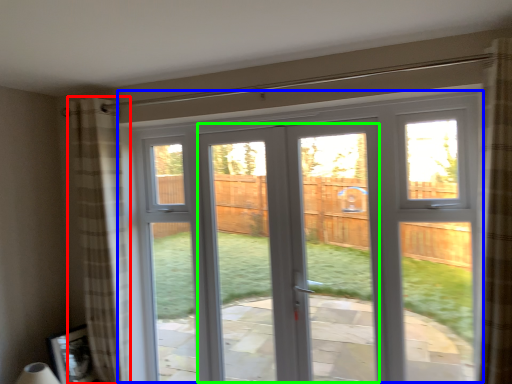
Question: Which object is positioned farthest from curtain (highlighted by a red box)? Select from window (highlighted by a blue box) and screen door (highlighted by a green box).

Choices:
 (A) window
 (B) screen door

Answer: (B)